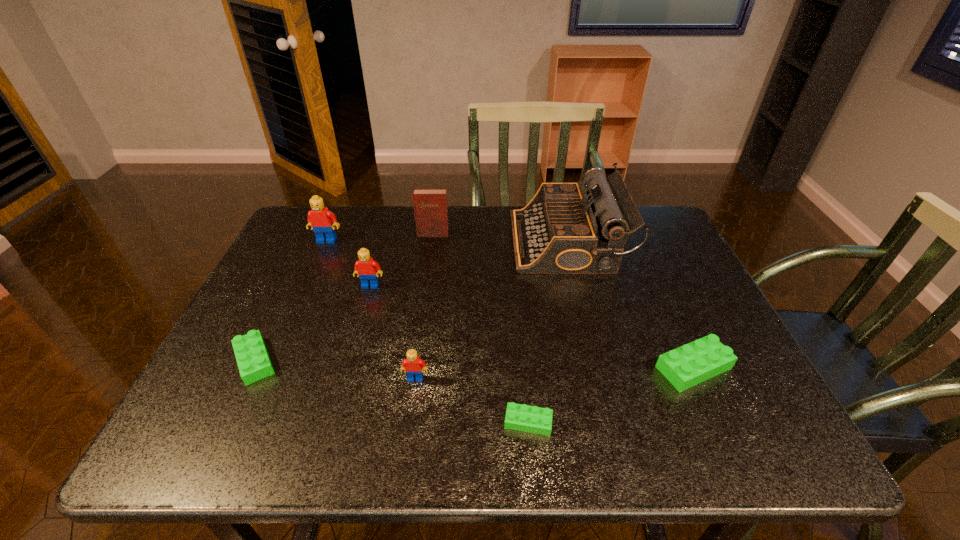
The height and width of the screenshot is (540, 960). What are the coordinates of `vacant space located on the face of the rightmost red Lego` in the screenshot? It's located at (410, 416).

Locate an element on the screen. Image resolution: width=960 pixels, height=540 pixels. blank space located 0.090m on the left of the sixth tallest object is located at coordinates (614, 368).

I want to click on vacant area located on the right of the seventh tallest object, so click(348, 361).

Image resolution: width=960 pixels, height=540 pixels. What are the coordinates of `vacant space located on the right of the nearest Lego` in the screenshot? It's located at (609, 422).

At what (x,y) coordinates should I click in order to perform the action: click on typewriter present at the far edge. Please return your answer as a coordinate pair (x, y). This screenshot has height=540, width=960. Looking at the image, I should click on (563, 230).

The height and width of the screenshot is (540, 960). I want to click on Lego that is at the far edge, so click(322, 221).

At what (x,y) coordinates should I click in order to perform the action: click on diary that is at the far edge. Please return your answer as a coordinate pair (x, y). Looking at the image, I should click on (430, 204).

Image resolution: width=960 pixels, height=540 pixels. I want to click on object at the near edge, so click(x=532, y=419).

The height and width of the screenshot is (540, 960). In order to click on object at the right edge in this screenshot , I will do `click(684, 367)`.

The height and width of the screenshot is (540, 960). Identify the location of object located at the far left corner. (322, 221).